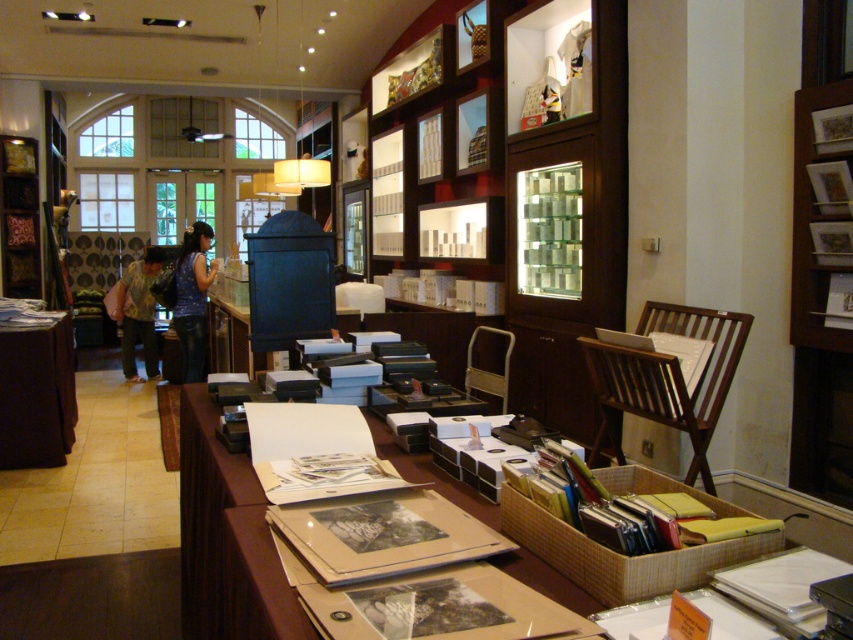
In the scene shown: You are a customer entering the store and want to see the items on the brown fabric table at lower left and the wooden bookshelf at left. Which one should you approach first to get a closer look?

You should approach the brown fabric table at lower left first because it is in front of the wooden bookshelf at left, making it closer to you as you enter the store.

You are standing in the store and want to take a photo of both the point at coordinates point (202,435) and point (38,234). Which point should you focus on first to ensure both are in focus?

You should focus on point (38,234) first because it is farther from the camera, ensuring the depth of field captures both points.

You are a customer in the store and want to find the brown cardboard table at center and the wooden bookshelf at left. Based on the scene description, which object is located to the right of the other?

The brown cardboard table at center is positioned on the right side of wooden bookshelf at left, so the brown cardboard table at center is to the right of the wooden bookshelf at left.